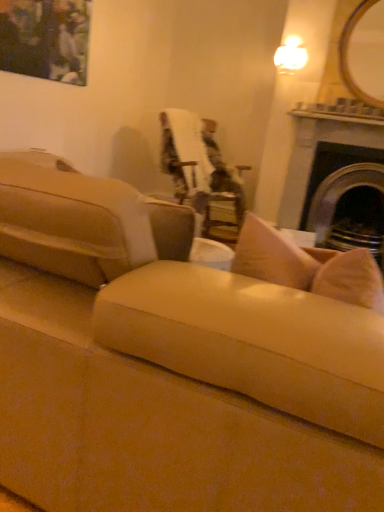
At what (x,y) coordinates should I click in order to perform the action: click on suede beige couch at center, which is the second studio couch in left-to-right order. Please return your answer as a coordinate pair (x, y). This screenshot has width=384, height=512. Looking at the image, I should click on (85, 223).

Describe the element at coordinates (364, 53) in the screenshot. I see `wooden framed mirror at upper right` at that location.

The width and height of the screenshot is (384, 512). Describe the element at coordinates (170, 365) in the screenshot. I see `suede beige couch at center, the first studio couch when ordered from left to right` at that location.

Consider the image. What is the approximate height of matte black painting at upper left?

25.76 inches.

The height and width of the screenshot is (512, 384). Describe the element at coordinates (46, 39) in the screenshot. I see `matte black painting at upper left` at that location.

What are the coordinates of `suede beige couch at center, the 1th studio couch positioned from the right` in the screenshot? It's located at (85, 223).

Is velvet upholstered chair at center positioned in front of wooden framed mirror at upper right?

No, it is behind wooden framed mirror at upper right.

From a real-world perspective, is velvet upholstered chair at center over wooden framed mirror at upper right?

No, from a real-world perspective, velvet upholstered chair at center is not over wooden framed mirror at upper right

Which of these two, velvet upholstered chair at center or wooden framed mirror at upper right, stands taller?

Standing taller between the two is velvet upholstered chair at center.

How many degrees apart are the facing directions of velvet upholstered chair at center and wooden framed mirror at upper right?

The angular difference between velvet upholstered chair at center and wooden framed mirror at upper right is 60.4 degrees.

Who is taller, dark gray stone fireplace at right or velvet upholstered chair at center?

With more height is dark gray stone fireplace at right.

Is dark gray stone fireplace at right facing towards velvet upholstered chair at center?

No, dark gray stone fireplace at right is not facing towards velvet upholstered chair at center.

Which is less distant, (x=295, y=215) or (x=198, y=162)?

The point (x=295, y=215) is in front.

Based on their positions, is dark gray stone fireplace at right located to the left or right of velvet upholstered chair at center?

dark gray stone fireplace at right is positioned on velvet upholstered chair at center's right side.

In the scene shown: Between suede beige couch at center, the 1th studio couch positioned from the right, and velvet upholstered chair at center, which one has less height?

With less height is suede beige couch at center, the 1th studio couch positioned from the right.

Considering the relative sizes of suede beige couch at center, the 1th studio couch positioned from the right, and velvet upholstered chair at center in the image provided, is suede beige couch at center, the 1th studio couch positioned from the right, thinner than velvet upholstered chair at center?

Yes, suede beige couch at center, the 1th studio couch positioned from the right, is thinner than velvet upholstered chair at center.

In the scene shown: Between suede beige couch at center, the 1th studio couch positioned from the right, and velvet upholstered chair at center, which one appears on the left side from the viewer's perspective?

Positioned to the left is suede beige couch at center, the 1th studio couch positioned from the right.

Between point (30, 212) and point (199, 191), which one is positioned behind?

The point (199, 191) is behind.

How different are the orientations of wooden framed mirror at upper right and suede beige couch at center, which is the second studio couch in left-to-right order, in degrees?

The facing directions of wooden framed mirror at upper right and suede beige couch at center, which is the second studio couch in left-to-right order, are 175 degrees apart.

Is wooden framed mirror at upper right taller than suede beige couch at center, the 1th studio couch positioned from the right?

Yes.

Is wooden framed mirror at upper right facing away from suede beige couch at center, which is the second studio couch in left-to-right order?

That's not correct — wooden framed mirror at upper right is not looking away from suede beige couch at center, which is the second studio couch in left-to-right order.

Which of these two, wooden framed mirror at upper right or suede beige couch at center, the 1th studio couch positioned from the right, is wider?

suede beige couch at center, the 1th studio couch positioned from the right.

Identify the location of picture frame above the velvet upholstered chair at center (from a real-world perspective). The width and height of the screenshot is (384, 512). (46, 39).

Is matte black painting at upper left taller than velvet upholstered chair at center?

No, matte black painting at upper left is not taller than velvet upholstered chair at center.

Based on the photo, is suede beige couch at center, the 2th studio couch from the right, oriented away from velvet upholstered chair at center?

suede beige couch at center, the 2th studio couch from the right, is not turned away from velvet upholstered chair at center.

From the image's perspective, is suede beige couch at center, the 2th studio couch from the right, over velvet upholstered chair at center?

No, from the image's perspective, suede beige couch at center, the 2th studio couch from the right, is not on top of velvet upholstered chair at center.

This screenshot has height=512, width=384. In order to click on chair located above the suede beige couch at center, the 2th studio couch from the right (from a real-world perspective) in this screenshot , I will do `click(200, 170)`.

Between suede beige couch at center, the 2th studio couch from the right, and velvet upholstered chair at center, which one has less height?

With less height is suede beige couch at center, the 2th studio couch from the right.

Is point (82, 493) more distant than point (53, 19)?

That is False.

From a real-world perspective, does suede beige couch at center, the first studio couch when ordered from left to right, sit lower than matte black painting at upper left?

Yes.

Which is more to the right, suede beige couch at center, the 2th studio couch from the right, or matte black painting at upper left?

Positioned to the right is suede beige couch at center, the 2th studio couch from the right.

Considering the sizes of objects suede beige couch at center, the 2th studio couch from the right, and matte black painting at upper left in the image provided, who is taller, suede beige couch at center, the 2th studio couch from the right, or matte black painting at upper left?

With more height is suede beige couch at center, the 2th studio couch from the right.

At what (x,y) coordinates should I click in order to perform the action: click on chair behind the wooden framed mirror at upper right. Please return your answer as a coordinate pair (x, y). Looking at the image, I should click on (200, 170).

Identify the location of fireplace below the velvet upholstered chair at center (from the image's perspective). (314, 152).

Which object lies nearer to the anchor point dark gray stone fireplace at right, suede beige couch at center, the 2th studio couch from the right, or matte black painting at upper left?

Based on the image, matte black painting at upper left appears to be nearer to dark gray stone fireplace at right.

In the scene shown: Considering their positions, is wooden framed mirror at upper right positioned closer to velvet upholstered chair at center than matte black painting at upper left?

matte black painting at upper left lies closer to velvet upholstered chair at center than the other object.

Based on their spatial positions, is suede beige couch at center, the 2th studio couch from the right, or velvet upholstered chair at center closer to matte black painting at upper left?

velvet upholstered chair at center is closer to matte black painting at upper left.

Based on their spatial positions, is wooden framed mirror at upper right or suede beige couch at center, the 1th studio couch positioned from the right, closer to dark gray stone fireplace at right?

Among the two, wooden framed mirror at upper right is located nearer to dark gray stone fireplace at right.

Estimate the real-world distances between objects in this image. Which object is closer to suede beige couch at center, the 1th studio couch positioned from the right, wooden framed mirror at upper right or velvet upholstered chair at center?

Among the two, velvet upholstered chair at center is located nearer to suede beige couch at center, the 1th studio couch positioned from the right.

Based on the photo, looking at the image, which one is located closer to suede beige couch at center, the first studio couch when ordered from left to right, matte black painting at upper left or velvet upholstered chair at center?

matte black painting at upper left is positioned closer to the anchor suede beige couch at center, the first studio couch when ordered from left to right.

Considering their positions, is dark gray stone fireplace at right positioned further to suede beige couch at center, the first studio couch when ordered from left to right, than matte black painting at upper left?

dark gray stone fireplace at right is further to suede beige couch at center, the first studio couch when ordered from left to right.

Looking at the image, which one is located closer to suede beige couch at center, which is the second studio couch in left-to-right order, wooden framed mirror at upper right or suede beige couch at center, the 2th studio couch from the right?

suede beige couch at center, the 2th studio couch from the right.

Identify the location of studio couch located between suede beige couch at center, the first studio couch when ordered from left to right, and velvet upholstered chair at center in the depth direction. This screenshot has height=512, width=384. (85, 223).

Find the location of a particular element. The height and width of the screenshot is (512, 384). chair between suede beige couch at center, the 1th studio couch positioned from the right, and dark gray stone fireplace at right from front to back is located at coordinates (200, 170).

Image resolution: width=384 pixels, height=512 pixels. Identify the location of picture frame between suede beige couch at center, the 1th studio couch positioned from the right, and velvet upholstered chair at center from front to back. (46, 39).

This screenshot has height=512, width=384. What are the coordinates of `mirror positioned between suede beige couch at center, the 2th studio couch from the right, and dark gray stone fireplace at right from near to far` in the screenshot? It's located at (364, 53).